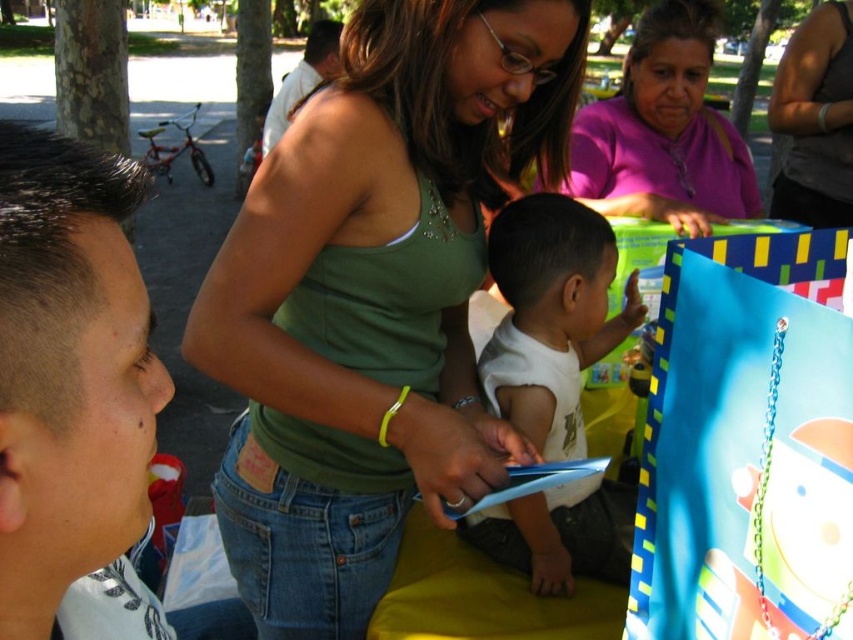
Question: Is dark gray tank top at upper right in front of light brown leather jacket at upper center?

Choices:
 (A) yes
 (B) no

Answer: (A)

Question: Can you confirm if purple matte shirt at upper center is thinner than dark gray tank top at upper right?

Choices:
 (A) yes
 (B) no

Answer: (B)

Question: Which point is farther to the camera?

Choices:
 (A) white matte shirt at center
 (B) light brown leather jacket at upper center
 (C) purple matte shirt at upper center
 (D) short hair at left

Answer: (B)

Question: Considering the real-world distances, which object is farthest from the purple matte shirt at upper center?

Choices:
 (A) green tank top at center
 (B) dark gray tank top at upper right
 (C) white matte shirt at center

Answer: (B)

Question: Is green tank top at center thinner than purple matte shirt at upper center?

Choices:
 (A) yes
 (B) no

Answer: (A)

Question: Which object is positioned farthest from the green tank top at center?

Choices:
 (A) light brown leather jacket at upper center
 (B) white matte shirt at center
 (C) short hair at left

Answer: (A)